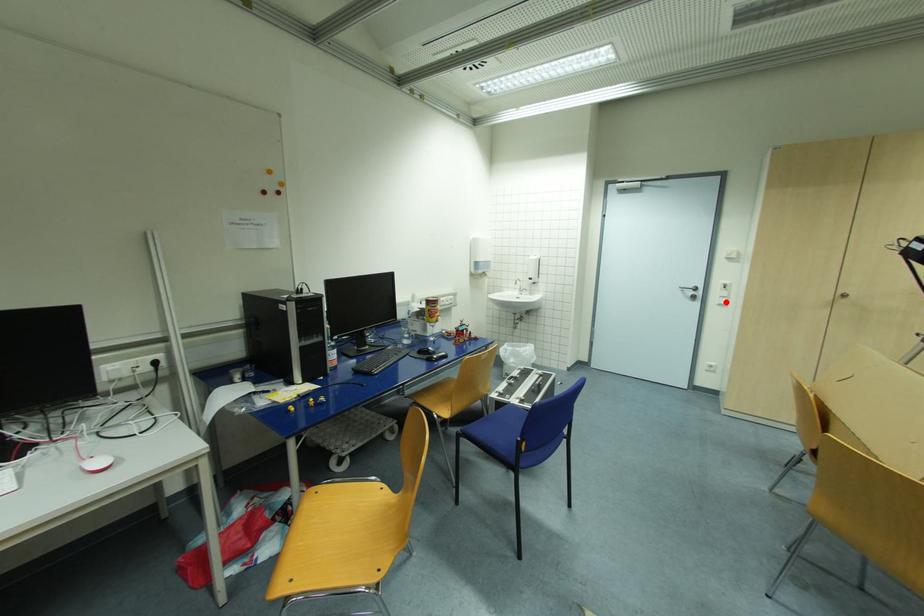
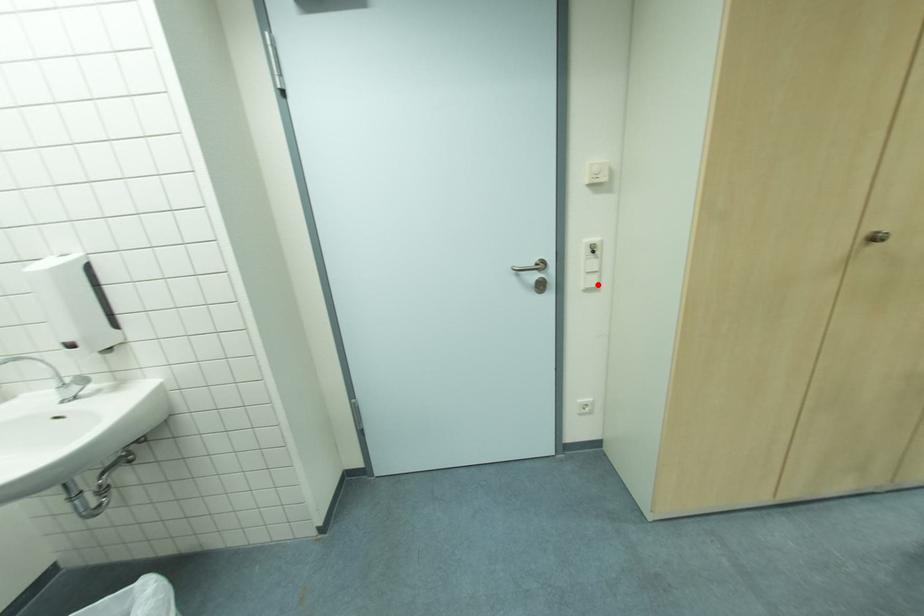
I am providing you with two images of the same scene from different viewpoints. A red point is marked on the first image and another point is marked on the second image. Does the point marked in image1 correspond to the same location as the one in image2?

Yes